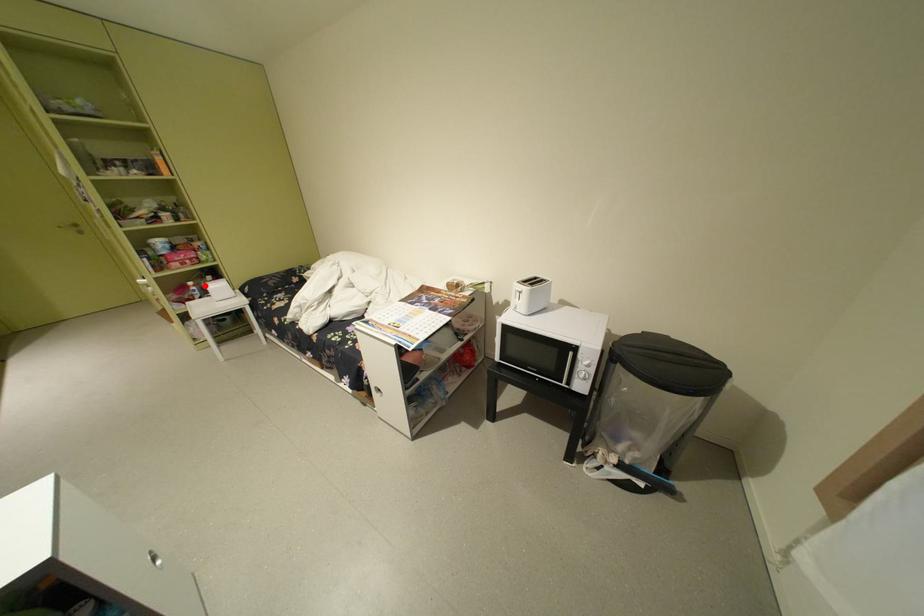
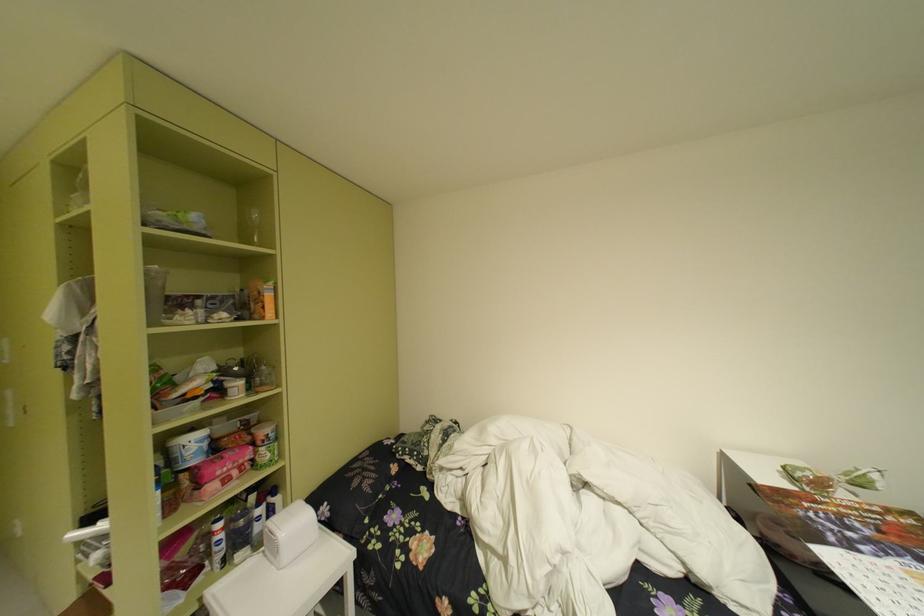
Find the pixel in the second image that matches the highlighted location in the first image.

(235, 528)